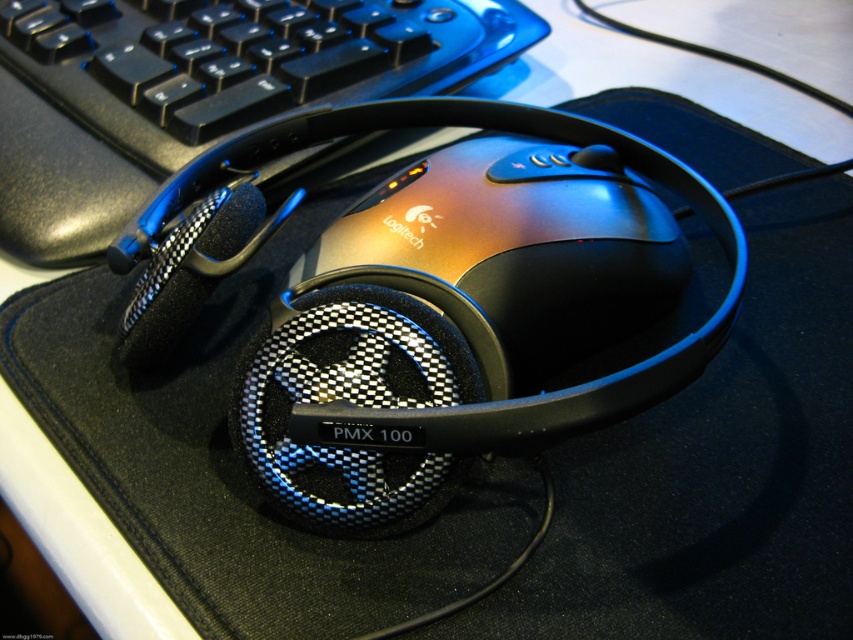
You are standing in front of a computer workstation. There is a point at coordinates point (x=67, y=168). Can you reach that point without moving your hand more than 30 inches from your body?

The distance between point (x=67, y=168) and the viewer is 29.16 inches, so yes, you can reach it without moving your hand more than 30 inches from your body.